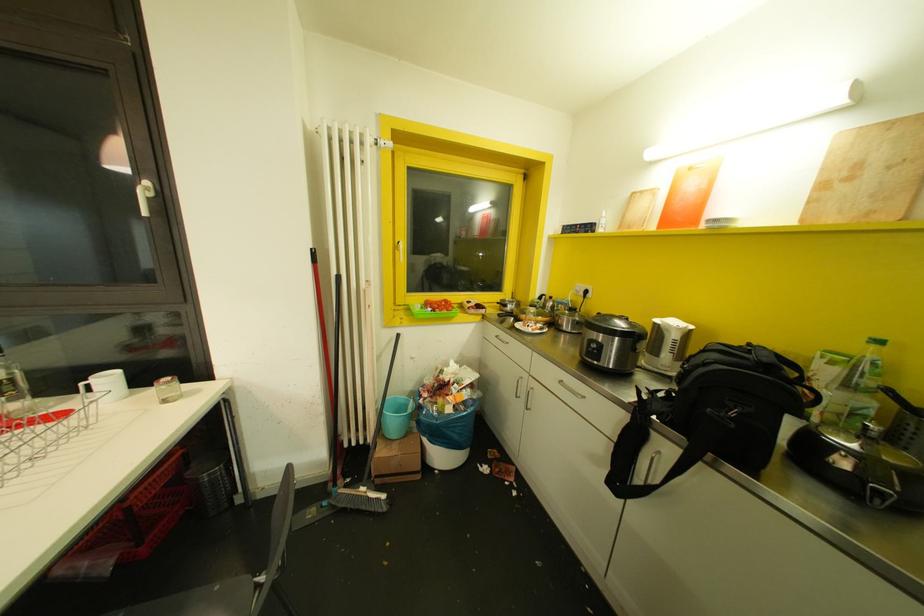
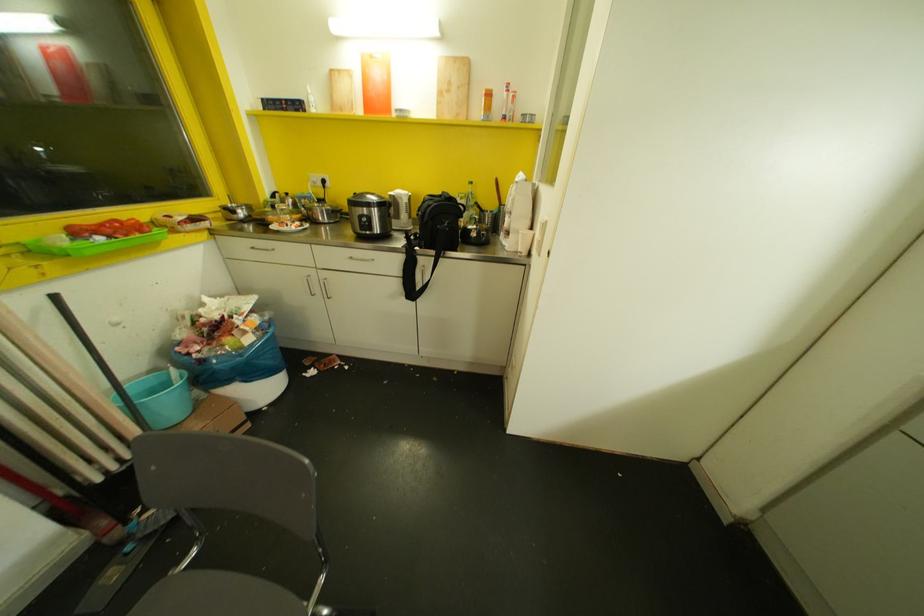
In the second image, find the point that corresponds to [429,309] in the first image.

(99, 237)